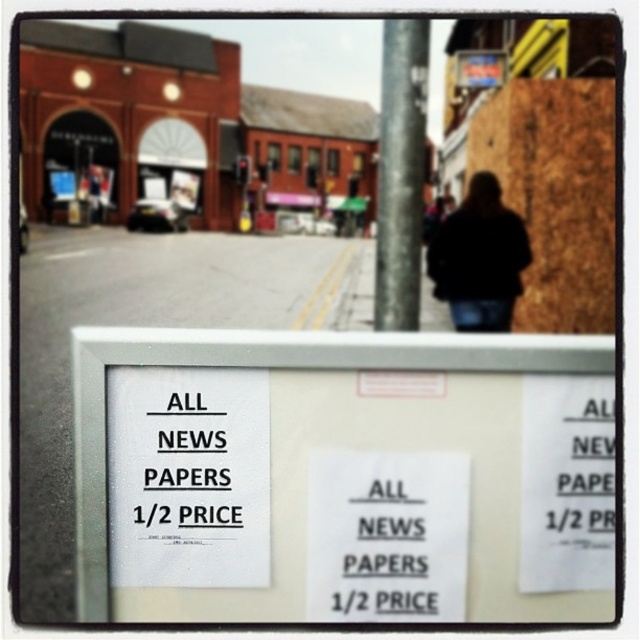
Does point (179, 339) come behind point (74, 321)?

Yes, point (179, 339) is farther from viewer.

Which of these two, white paper sign at center or white paper sign at lower center, stands taller?

With more height is white paper sign at lower center.

Does point (268, 572) lie in front of point (134, 292)?

No, (268, 572) is further to viewer.

At what (x,y) coordinates should I click in order to perform the action: click on white paper sign at center. Please return your answer as a coordinate pair (x, y). This screenshot has width=640, height=640. Looking at the image, I should click on (342, 476).

Is silver metallic pole at center smaller than black fabric at center?

No, silver metallic pole at center is not smaller than black fabric at center.

Does point (410, 179) come closer to viewer compared to point (442, 253)?

No, it is not.

Find the location of a particular element. silver metallic pole at center is located at coordinates (401, 172).

Is white paper sign at center smaller than silver metallic pole at center?

Incorrect, white paper sign at center is not smaller in size than silver metallic pole at center.

Which of these two, white paper sign at center or silver metallic pole at center, stands taller?

Standing taller between the two is silver metallic pole at center.

This screenshot has width=640, height=640. In order to click on white paper sign at center in this screenshot , I will do `click(342, 476)`.

At what (x,y) coordinates should I click in order to perform the action: click on white paper sign at center. Please return your answer as a coordinate pair (x, y). This screenshot has height=640, width=640. Looking at the image, I should click on (x=342, y=476).